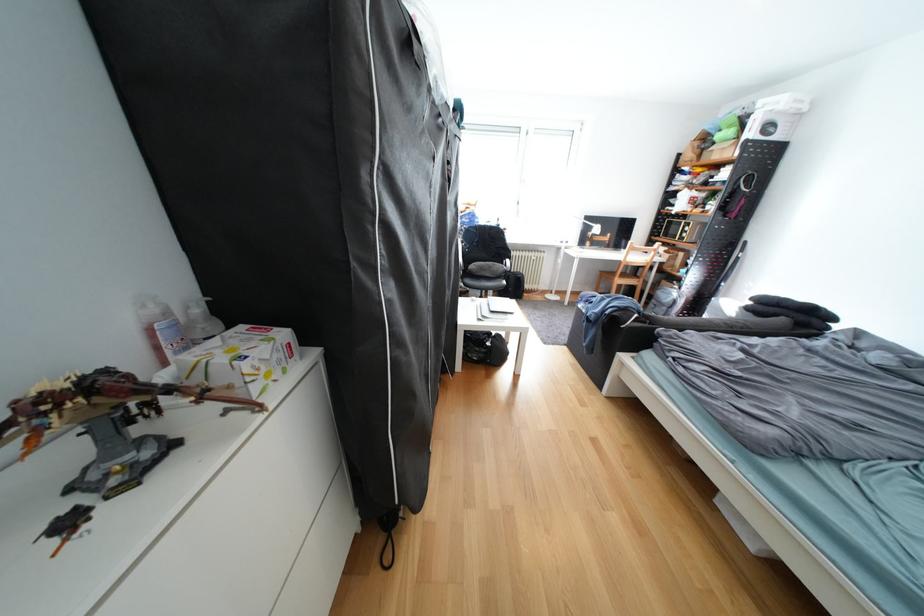
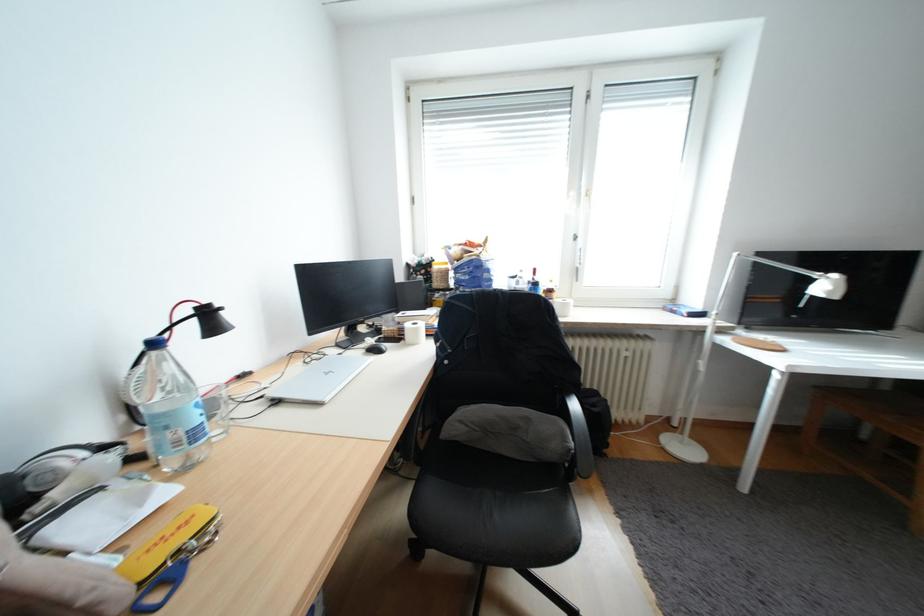
Question: In a continuous first-person perspective shot, in which direction is the camera moving?

Choices:
 (A) Left
 (B) Right
 (C) Forward
 (D) Backward

Answer: (C)